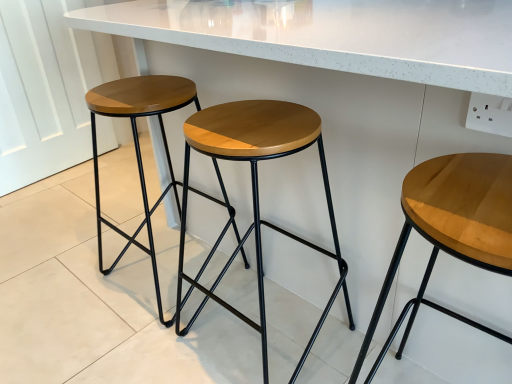
Find the location of a particular element. The image size is (512, 384). wooden/matte stool at center, which is counted as the 2th stool, starting from the right is located at coordinates (255, 191).

This screenshot has width=512, height=384. What are the coordinates of `light brown wood stool at center, acting as the 1th stool starting from the right` in the screenshot? It's located at (451, 230).

What do you see at coordinates (139, 145) in the screenshot?
I see `wooden seat at center, placed as the 3th stool when sorted from right to left` at bounding box center [139, 145].

Find the location of a particular element. wooden/matte stool at center, positioned as the second stool in left-to-right order is located at coordinates (255, 191).

In the scene shown: Does wooden/matte stool at center, positioned as the second stool in left-to-right order, touch wooden seat at center, which ranks as the 1th stool in left-to-right order?

wooden/matte stool at center, positioned as the second stool in left-to-right order, and wooden seat at center, which ranks as the 1th stool in left-to-right order, are clearly separated.

Which of these two, wooden/matte stool at center, positioned as the second stool in left-to-right order, or wooden seat at center, which ranks as the 1th stool in left-to-right order, is smaller?

With smaller size is wooden/matte stool at center, positioned as the second stool in left-to-right order.

Is wooden/matte stool at center, positioned as the second stool in left-to-right order, looking in the opposite direction of wooden seat at center, placed as the 3th stool when sorted from right to left?

wooden/matte stool at center, positioned as the second stool in left-to-right order, does not have its back to wooden seat at center, placed as the 3th stool when sorted from right to left.

From the image's perspective, is wooden/matte stool at center, which is counted as the 2th stool, starting from the right, below wooden seat at center, placed as the 3th stool when sorted from right to left?

Indeed, from the image's perspective, wooden/matte stool at center, which is counted as the 2th stool, starting from the right, is shown beneath wooden seat at center, placed as the 3th stool when sorted from right to left.

There is a light brown wood stool at center, acting as the 3th stool starting from the left. Where is `the 1st stool above it (from a real-world perspective)`? the 1st stool above it (from a real-world perspective) is located at coordinates (255, 191).

Consider the image. What's the angular difference between wooden/matte stool at center, which is counted as the 2th stool, starting from the right, and light brown wood stool at center, acting as the 3th stool starting from the left,'s facing directions?

They differ by 0.000387 degrees in their facing directions.

Can you confirm if wooden/matte stool at center, which is counted as the 2th stool, starting from the right, is wider than light brown wood stool at center, acting as the 1th stool starting from the right?

No.

Could you measure the distance between wooden/matte stool at center, positioned as the second stool in left-to-right order, and light brown wood stool at center, acting as the 3th stool starting from the left?

wooden/matte stool at center, positioned as the second stool in left-to-right order, is 15.06 inches from light brown wood stool at center, acting as the 3th stool starting from the left.

Considering the relative sizes of wooden seat at center, which ranks as the 1th stool in left-to-right order, and wooden/matte stool at center, which is counted as the 2th stool, starting from the right, in the image provided, is wooden seat at center, which ranks as the 1th stool in left-to-right order, wider than wooden/matte stool at center, which is counted as the 2th stool, starting from the right,?

Yes, wooden seat at center, which ranks as the 1th stool in left-to-right order, is wider than wooden/matte stool at center, which is counted as the 2th stool, starting from the right.

From the image's perspective, would you say wooden seat at center, which ranks as the 1th stool in left-to-right order, is shown under wooden/matte stool at center, which is counted as the 2th stool, starting from the right?

No.

Is wooden seat at center, placed as the 3th stool when sorted from right to left, smaller than wooden/matte stool at center, positioned as the second stool in left-to-right order?

Incorrect, wooden seat at center, placed as the 3th stool when sorted from right to left, is not smaller in size than wooden/matte stool at center, positioned as the second stool in left-to-right order.

Does wooden seat at center, placed as the 3th stool when sorted from right to left, turn towards wooden/matte stool at center, which is counted as the 2th stool, starting from the right?

No.

Is light brown wood stool at center, acting as the 3th stool starting from the left, outside of wooden seat at center, which ranks as the 1th stool in left-to-right order?

light brown wood stool at center, acting as the 3th stool starting from the left, lies outside wooden seat at center, which ranks as the 1th stool in left-to-right order,'s area.

From the image's perspective, which is below, light brown wood stool at center, acting as the 1th stool starting from the right, or wooden seat at center, which ranks as the 1th stool in left-to-right order?

light brown wood stool at center, acting as the 1th stool starting from the right, appears lower in the image.

What's the angular difference between light brown wood stool at center, acting as the 1th stool starting from the right, and wooden seat at center, placed as the 3th stool when sorted from right to left,'s facing directions?

They differ by 0.000255 degrees in their facing directions.

Based on their sizes in the image, would you say light brown wood stool at center, acting as the 1th stool starting from the right, is bigger or smaller than wooden seat at center, placed as the 3th stool when sorted from right to left?

Clearly, light brown wood stool at center, acting as the 1th stool starting from the right, is smaller in size than wooden seat at center, placed as the 3th stool when sorted from right to left.

At what (x,y) coordinates should I click in order to perform the action: click on the 1st stool behind the light brown wood stool at center, acting as the 1th stool starting from the right, starting your count from the anchor. Please return your answer as a coordinate pair (x, y). Looking at the image, I should click on (255, 191).

Does light brown wood stool at center, acting as the 3th stool starting from the left, have a larger size compared to wooden/matte stool at center, positioned as the second stool in left-to-right order?

Incorrect, light brown wood stool at center, acting as the 3th stool starting from the left, is not larger than wooden/matte stool at center, positioned as the second stool in left-to-right order.

Which object is further away from the camera taking this photo, light brown wood stool at center, acting as the 1th stool starting from the right, or wooden/matte stool at center, which is counted as the 2th stool, starting from the right?

wooden/matte stool at center, which is counted as the 2th stool, starting from the right, is further from the camera.

Is light brown wood stool at center, acting as the 1th stool starting from the right, shorter than wooden/matte stool at center, positioned as the second stool in left-to-right order?

Yes.

Which is in front, point (127, 239) or point (508, 271)?

Point (508, 271)

From the image's perspective, is wooden seat at center, placed as the 3th stool when sorted from right to left, below light brown wood stool at center, acting as the 1th stool starting from the right?

Incorrect, from the image's perspective, wooden seat at center, placed as the 3th stool when sorted from right to left, is higher than light brown wood stool at center, acting as the 1th stool starting from the right.

From a real-world perspective, is wooden seat at center, placed as the 3th stool when sorted from right to left, below light brown wood stool at center, acting as the 1th stool starting from the right?

Actually, wooden seat at center, placed as the 3th stool when sorted from right to left, is physically above light brown wood stool at center, acting as the 1th stool starting from the right, in the real world.

Is wooden seat at center, placed as the 3th stool when sorted from right to left, positioned far away from light brown wood stool at center, acting as the 3th stool starting from the left?

No, wooden seat at center, placed as the 3th stool when sorted from right to left, is not far away from light brown wood stool at center, acting as the 3th stool starting from the left.

This screenshot has height=384, width=512. Identify the location of stool lying on the left of wooden/matte stool at center, which is counted as the 2th stool, starting from the right. (139, 145).

At what (x,y) coordinates should I click in order to perform the action: click on stool on the right of wooden/matte stool at center, which is counted as the 2th stool, starting from the right. Please return your answer as a coordinate pair (x, y). This screenshot has width=512, height=384. Looking at the image, I should click on (451, 230).

Which object lies further to the anchor point wooden/matte stool at center, which is counted as the 2th stool, starting from the right, light brown wood stool at center, acting as the 3th stool starting from the left, or wooden seat at center, which ranks as the 1th stool in left-to-right order?

light brown wood stool at center, acting as the 3th stool starting from the left, lies further to wooden/matte stool at center, which is counted as the 2th stool, starting from the right, than the other object.

When comparing their distances from wooden seat at center, which ranks as the 1th stool in left-to-right order, does wooden/matte stool at center, positioned as the second stool in left-to-right order, or light brown wood stool at center, acting as the 1th stool starting from the right, seem further?

The object further to wooden seat at center, which ranks as the 1th stool in left-to-right order, is light brown wood stool at center, acting as the 1th stool starting from the right.

Based on their spatial positions, is wooden/matte stool at center, which is counted as the 2th stool, starting from the right, or wooden seat at center, placed as the 3th stool when sorted from right to left, further from light brown wood stool at center, acting as the 3th stool starting from the left?

Among the two, wooden seat at center, placed as the 3th stool when sorted from right to left, is located further to light brown wood stool at center, acting as the 3th stool starting from the left.

When comparing their distances from wooden seat at center, placed as the 3th stool when sorted from right to left, does light brown wood stool at center, acting as the 3th stool starting from the left, or wooden/matte stool at center, which is counted as the 2th stool, starting from the right, seem closer?

Among the two, wooden/matte stool at center, which is counted as the 2th stool, starting from the right, is located nearer to wooden seat at center, placed as the 3th stool when sorted from right to left.

From the image, which object appears to be farther from wooden/matte stool at center, positioned as the second stool in left-to-right order, wooden seat at center, placed as the 3th stool when sorted from right to left, or light brown wood stool at center, acting as the 3th stool starting from the left?

Answer: light brown wood stool at center, acting as the 3th stool starting from the left, is positioned further to the anchor wooden/matte stool at center, positioned as the second stool in left-to-right order.

When comparing their distances from light brown wood stool at center, acting as the 1th stool starting from the right, does wooden seat at center, placed as the 3th stool when sorted from right to left, or wooden/matte stool at center, which is counted as the 2th stool, starting from the right, seem closer?

wooden/matte stool at center, which is counted as the 2th stool, starting from the right.

The height and width of the screenshot is (384, 512). Find the location of `stool between wooden seat at center, which ranks as the 1th stool in left-to-right order, and light brown wood stool at center, acting as the 3th stool starting from the left`. stool between wooden seat at center, which ranks as the 1th stool in left-to-right order, and light brown wood stool at center, acting as the 3th stool starting from the left is located at coordinates (255, 191).